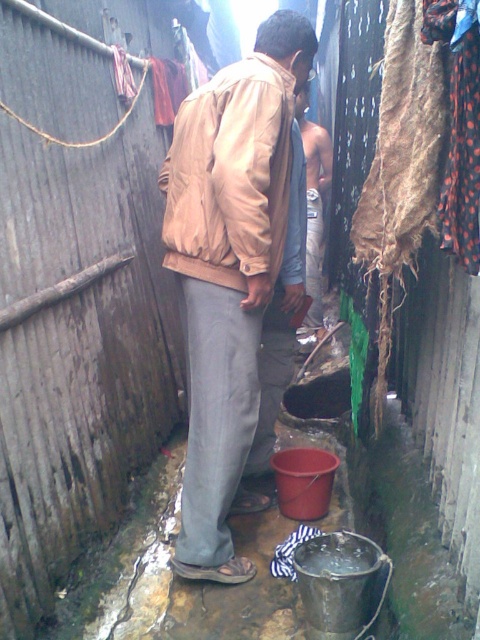
Question: Which point is closer to the camera taking this photo?

Choices:
 (A) (285, 205)
 (B) (190, 134)
 (C) (302, 145)

Answer: (B)

Question: Which point is closer to the camera?

Choices:
 (A) (250, 380)
 (B) (305, 266)

Answer: (A)

Question: Can you confirm if beige fabric jacket at center is bigger than light brown leather jacket at center?

Choices:
 (A) yes
 (B) no

Answer: (A)

Question: Is matte beige jacket at center bigger than light brown leather jacket at center?

Choices:
 (A) yes
 (B) no

Answer: (B)

Question: Which object is the closest to the light brown leather jacket at center?

Choices:
 (A) matte beige jacket at center
 (B) beige fabric jacket at center

Answer: (B)

Question: Where is beige fabric jacket at center located in relation to matte beige jacket at center in the image?

Choices:
 (A) left
 (B) right

Answer: (B)